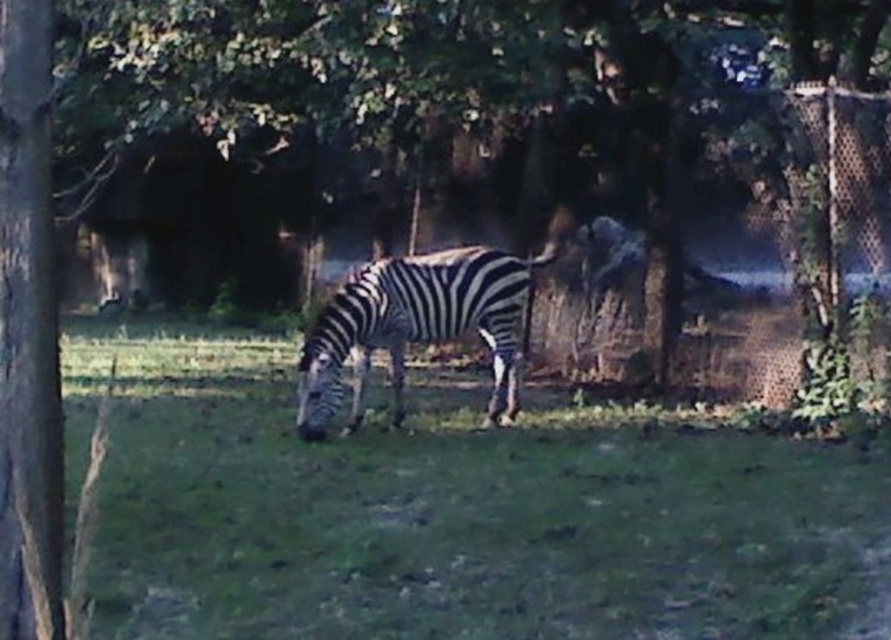
Is green grassy at center shorter than black and white striped zebra at center?

Correct, green grassy at center is not as tall as black and white striped zebra at center.

What do you see at coordinates (454, 509) in the screenshot?
I see `green grassy at center` at bounding box center [454, 509].

Where is `green grassy at center`? green grassy at center is located at coordinates (454, 509).